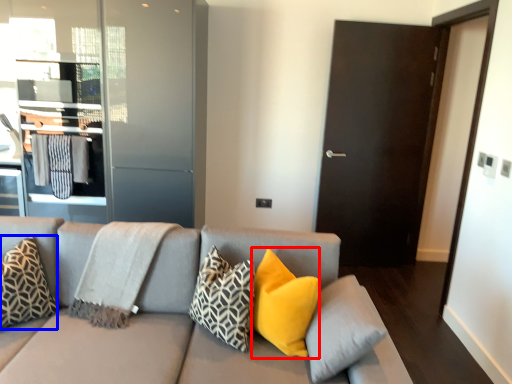
Question: Which object is further to the camera taking this photo, pillow (highlighted by a red box) or pillow (highlighted by a blue box)?

Choices:
 (A) pillow
 (B) pillow

Answer: (B)